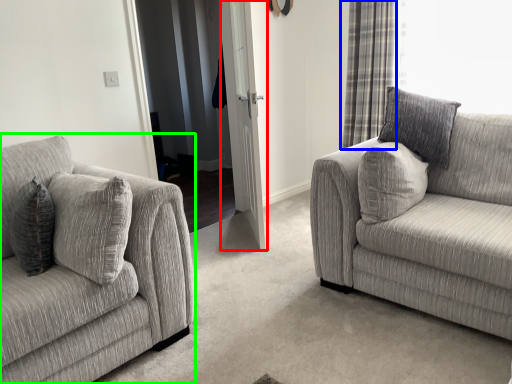
Question: Based on their relative distances, which object is nearer to screen door (highlighted by a red box)? Choose from curtain (highlighted by a blue box) and studio couch (highlighted by a green box).

Choices:
 (A) curtain
 (B) studio couch

Answer: (A)